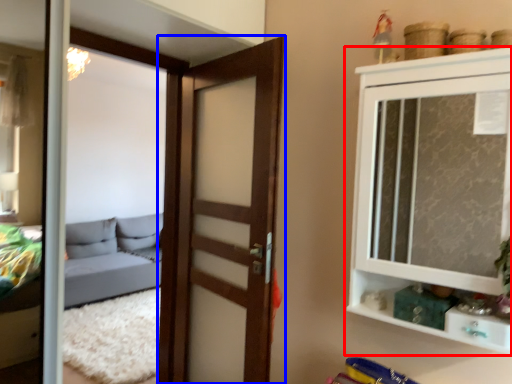
Question: Which point is closer to the camera, cupboard (highlighted by a red box) or door (highlighted by a blue box)?

Choices:
 (A) cupboard
 (B) door

Answer: (A)